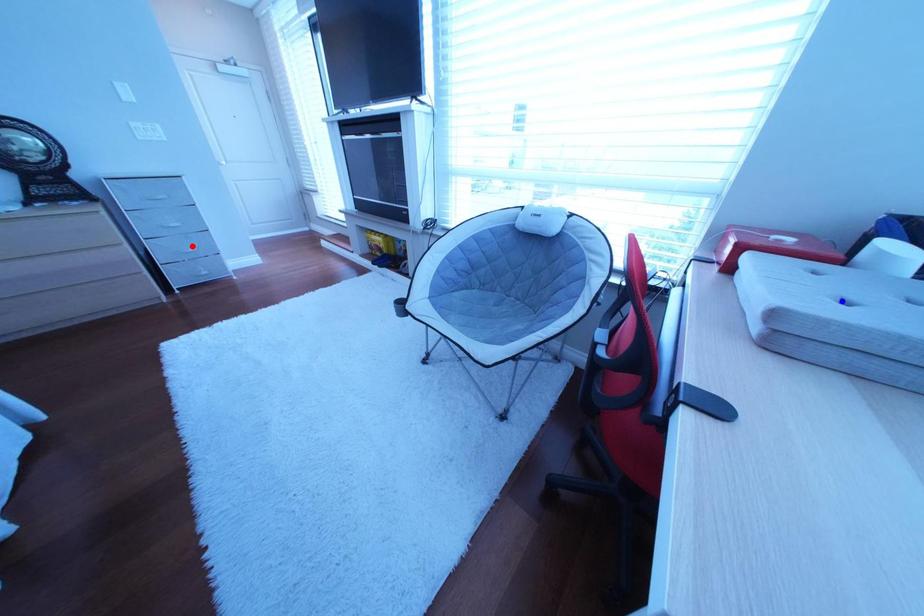
Question: Which of the two points in the image is closer to the camera?

Choices:
 (A) Blue point is closer.
 (B) Red point is closer.

Answer: (A)